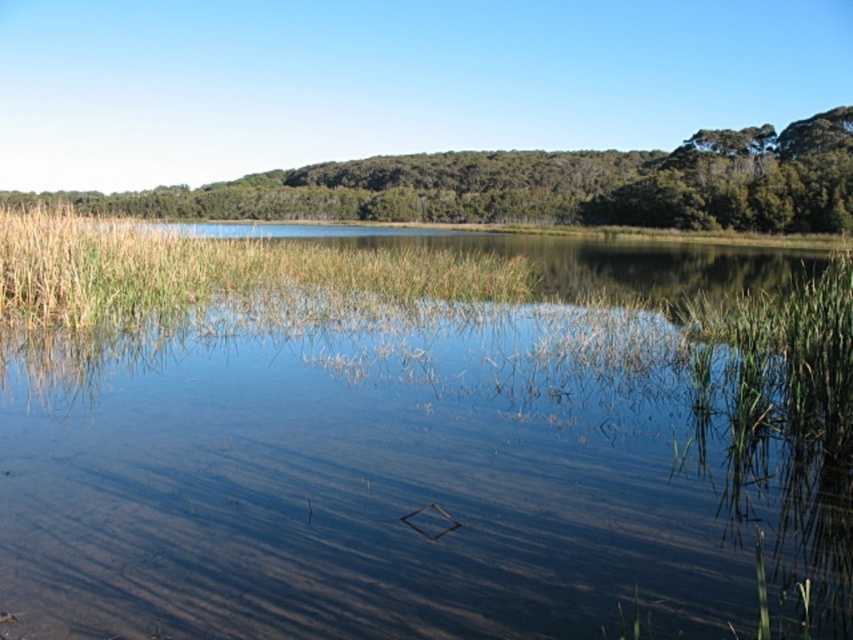
You are a photographer standing in the middle of the tall grasses and reeds. You want to take a photo of the green leafy tree at upper center with the green grass at center in the foreground. Is this possible given their positions?

The green grass at center is behind the green leafy tree at upper center, so it cannot be in the foreground of the tree. Therefore, you cannot take a photo of the green leafy tree at upper center with the green grass at center in the foreground because the grass is positioned behind the tree.